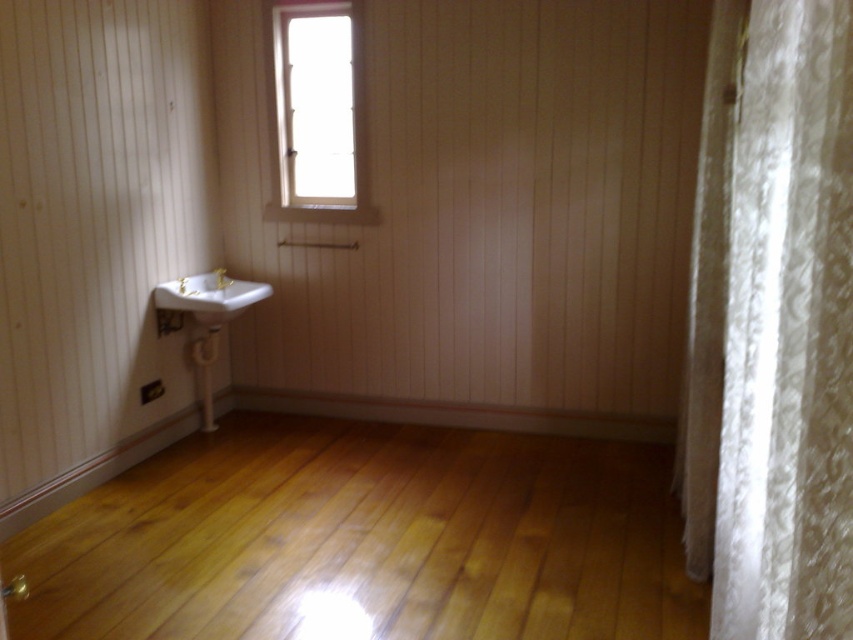
You are standing in the room and want to move from point (323, 60) to point (698, 237). Which direction should you move to get closer to the sink?

Since point (323, 60) is closer to you than point (698, 237), you should move away from the sink to reach point (698, 237).

You are a plumber trying to fix a leaky pipe in the bathroom. You see the matte gold faucet at lower left and the gold metallic faucet at left. Which faucet is closer to the wall?

The matte gold faucet at lower left is closer to the wall because it is positioned lower than the gold metallic faucet at left, which is higher up.